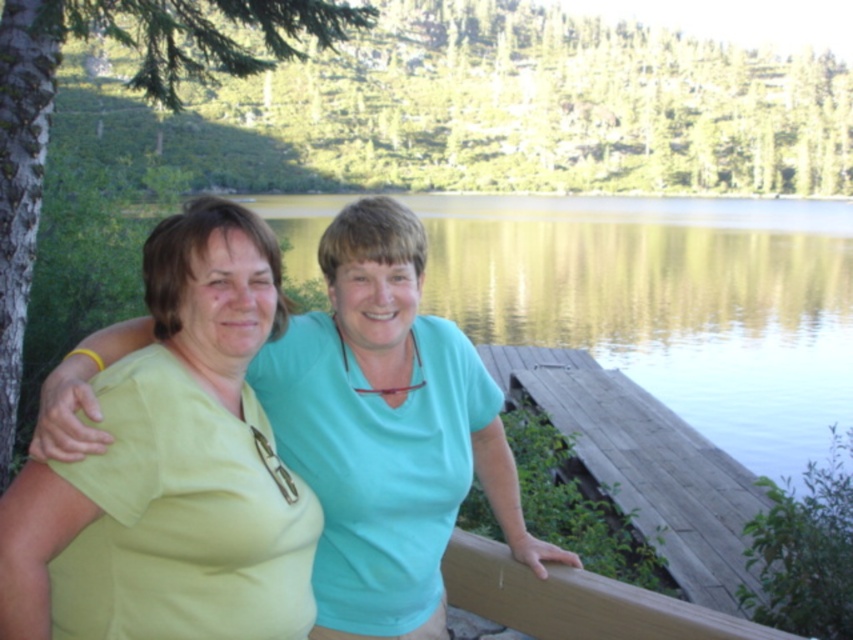
This screenshot has width=853, height=640. I want to click on matte green shirt at center, so click(173, 468).

Which is below, matte green shirt at center or wooden dock at lower right?

wooden dock at lower right is below.

Is point (96, 541) positioned after point (727, 609)?

No, it is in front of (727, 609).

Image resolution: width=853 pixels, height=640 pixels. Identify the location of matte green shirt at center. (173, 468).

Does matte green shirt at center appear over brown wood rail at lower center?

Correct, matte green shirt at center is located above brown wood rail at lower center.

Between point (61, 570) and point (587, 595), which one is positioned behind?

The point (587, 595) is more distant.

The image size is (853, 640). Find the location of `matte green shirt at center`. matte green shirt at center is located at coordinates (173, 468).

Who is positioned more to the left, wooden dock at lower right or brown wood rail at lower center?

From the viewer's perspective, brown wood rail at lower center appears more on the left side.

Can you confirm if wooden dock at lower right is positioned to the right of brown wood rail at lower center?

Indeed, wooden dock at lower right is positioned on the right side of brown wood rail at lower center.

Is point (601, 476) in front of point (491, 592)?

No.

Find the location of a particular element. The width and height of the screenshot is (853, 640). wooden dock at lower right is located at coordinates (641, 486).